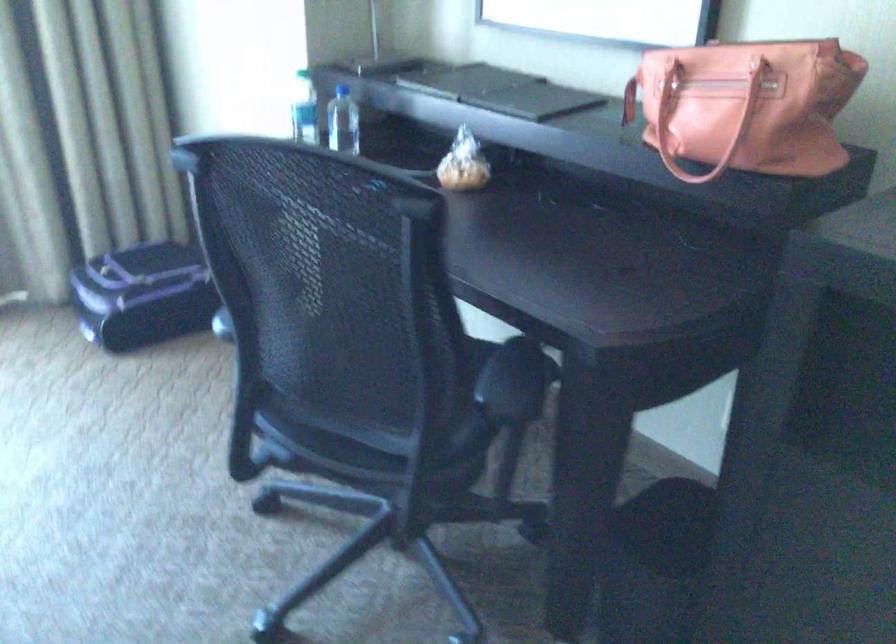
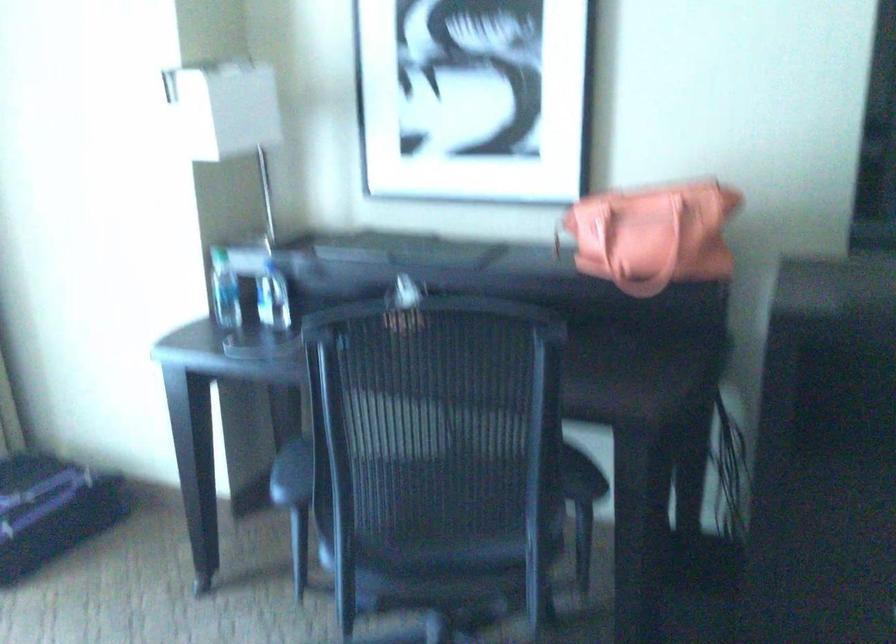
Where in the second image is the point corresponding to (x=304, y=111) from the first image?

(225, 290)